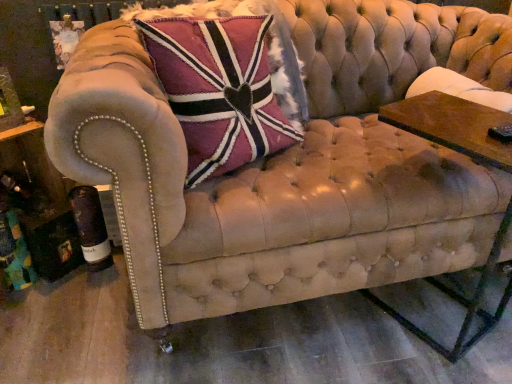
You are a GUI agent. You are given a task and a screenshot of the screen. Output one action in this format:
    pyautogui.click(x=<x>, y=<y>)
    Task: Click on the vacant space underneath wooden rectangular table at right (from a real-world perspective)
    The height and width of the screenshot is (384, 512).
    Given the screenshot: What is the action you would take?
    (447, 324)